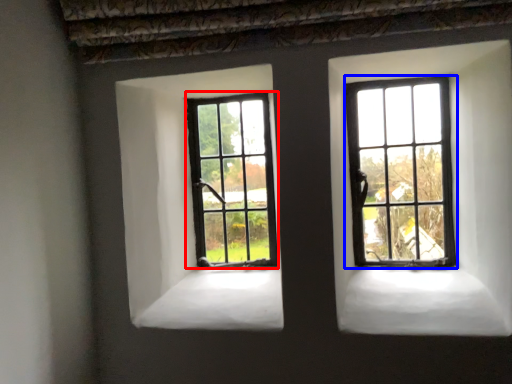
Question: Which object appears closest to the camera in this image, window (highlighted by a red box) or window (highlighted by a blue box)?

Choices:
 (A) window
 (B) window

Answer: (B)